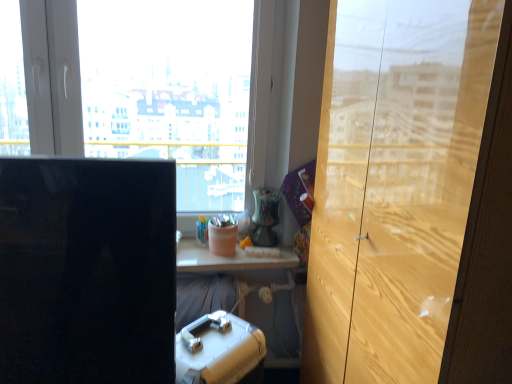
Question: In terms of height, does wooden cabinet at right look taller or shorter compared to pink matte container at center, positioned as the 2th stationery in back-to-front order?

Choices:
 (A) tall
 (B) short

Answer: (A)

Question: From the image's perspective, is wooden cabinet at right above or below pink matte container at center, which is counted as the 2th stationery, starting from the bottom?

Choices:
 (A) above
 (B) below

Answer: (B)

Question: Based on their relative distances, which object is nearer to the matte plastic cup at center, arranged as the 1th stationery when viewed from the top?

Choices:
 (A) wooden cabinet at right
 (B) transparent glass window at center
 (C) white plastic suitcase at lower center, the third stationery positioned from the top
 (D) pink matte container at center, which is counted as the 2th stationery, starting from the bottom
 (E) black glossy computer monitor at left

Answer: (D)

Question: Based on their relative distances, which object is nearer to the transparent glass window at center?

Choices:
 (A) white plastic suitcase at lower center, positioned as the 3th stationery in back-to-front order
 (B) matte plastic cup at center, which is counted as the third stationery, starting from the front
 (C) black glossy computer monitor at left
 (D) wooden cabinet at right
 (E) pink matte container at center, the 2th stationery when ordered from top to bottom

Answer: (E)